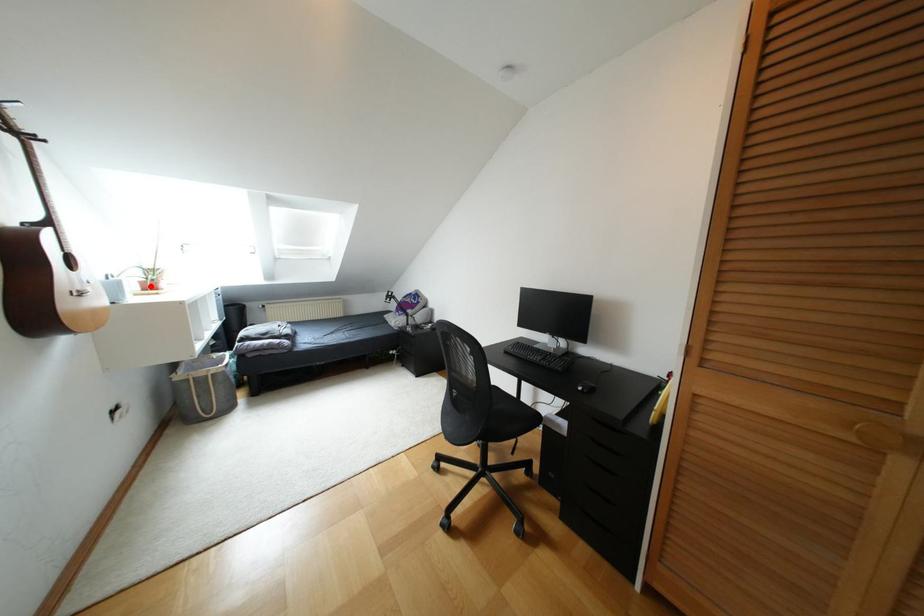
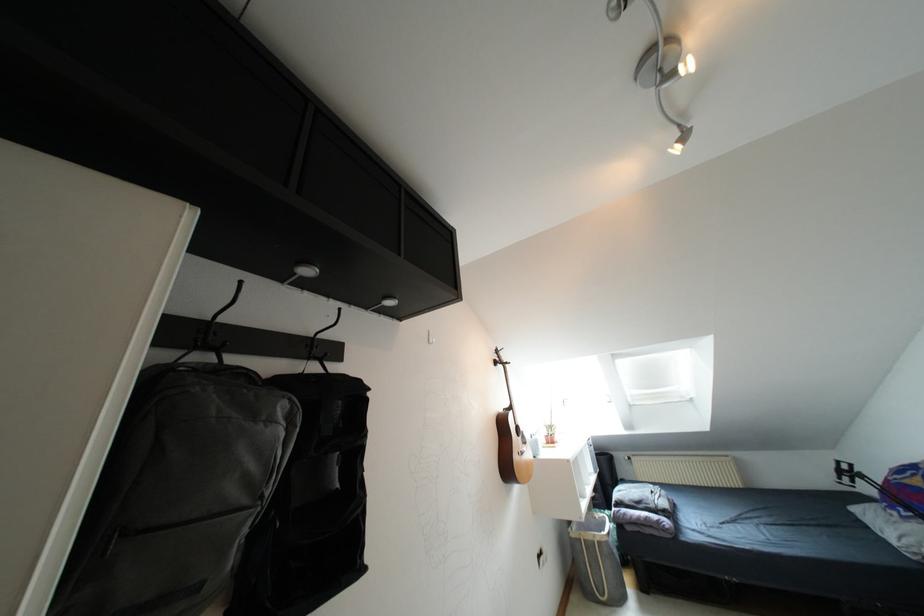
Question: A red point is marked in image1. In image2, is the corresponding 3D point closer to the camera or farther? Reply with the corresponding letter.

Choices:
 (A) The corresponding 3D point is closer.
 (B) The corresponding 3D point is farther.

Answer: (B)